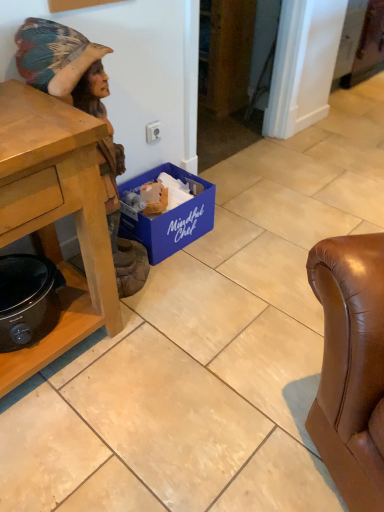
Where is `vacant region in front of wooden statue at left`? vacant region in front of wooden statue at left is located at coordinates (139, 326).